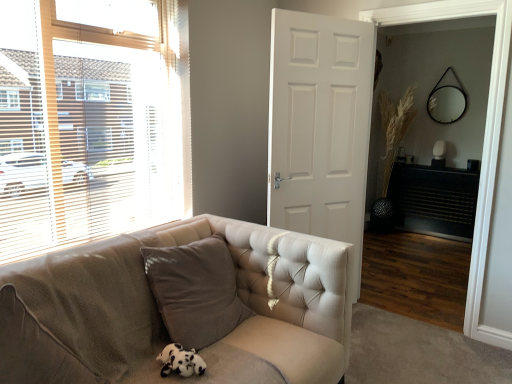
Question: Is wooden blinds at left outside wooden screen door at center?

Choices:
 (A) no
 (B) yes

Answer: (B)

Question: Can you see wooden blinds at left touching wooden screen door at center?

Choices:
 (A) no
 (B) yes

Answer: (A)

Question: Can you confirm if wooden blinds at left is wider than wooden screen door at center?

Choices:
 (A) yes
 (B) no

Answer: (B)

Question: From the image's perspective, is wooden blinds at left on top of wooden screen door at center?

Choices:
 (A) no
 (B) yes

Answer: (B)

Question: Does wooden blinds at left have a lesser width compared to wooden screen door at center?

Choices:
 (A) no
 (B) yes

Answer: (B)

Question: Considering the relative sizes of wooden blinds at left and wooden screen door at center in the image provided, is wooden blinds at left taller than wooden screen door at center?

Choices:
 (A) yes
 (B) no

Answer: (B)

Question: From a real-world perspective, is wooden screen door at center physically above wooden blinds at left?

Choices:
 (A) yes
 (B) no

Answer: (B)

Question: Does wooden screen door at center turn towards wooden blinds at left?

Choices:
 (A) yes
 (B) no

Answer: (B)

Question: Is wooden screen door at center closer to camera compared to wooden blinds at left?

Choices:
 (A) no
 (B) yes

Answer: (A)

Question: Does wooden screen door at center have a lesser height compared to wooden blinds at left?

Choices:
 (A) no
 (B) yes

Answer: (A)

Question: From the image's perspective, is wooden screen door at center beneath wooden blinds at left?

Choices:
 (A) no
 (B) yes

Answer: (B)

Question: Is wooden blinds at left inside wooden screen door at center?

Choices:
 (A) no
 (B) yes

Answer: (A)

Question: Is black textured fireplace at right aimed at wooden blinds at left?

Choices:
 (A) no
 (B) yes

Answer: (B)